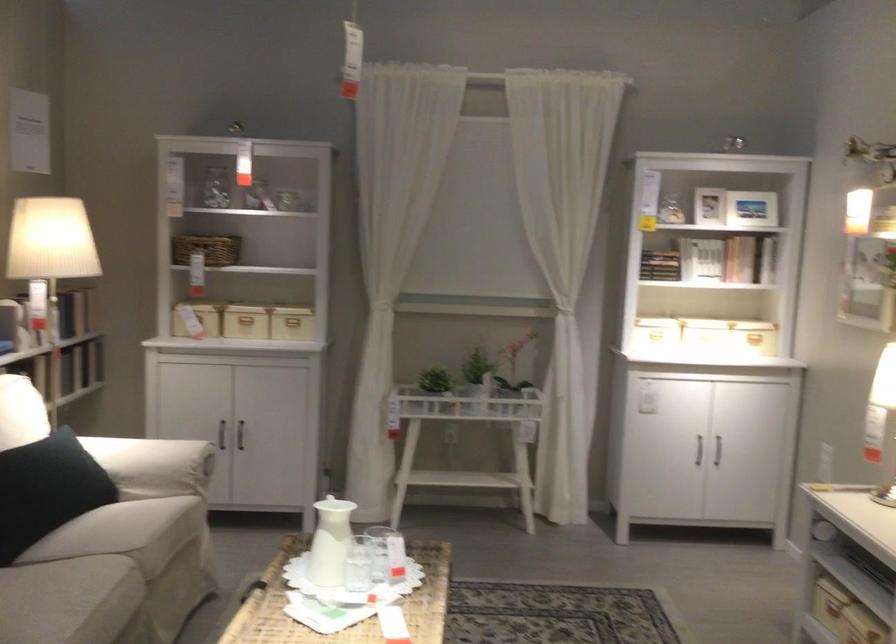
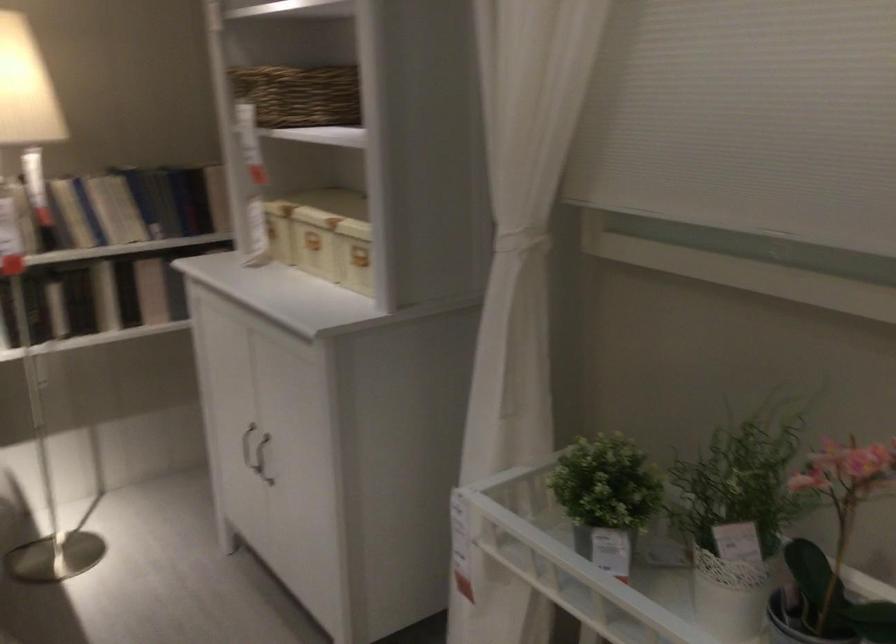
Question: I am providing you with two images of the same scene from different viewpoints. Please identify which objects are invisible in image2.

Choices:
 (A) potted green plant
 (B) book on shelf
 (C) white cabinet handle
 (D) none of these

Answer: (D)